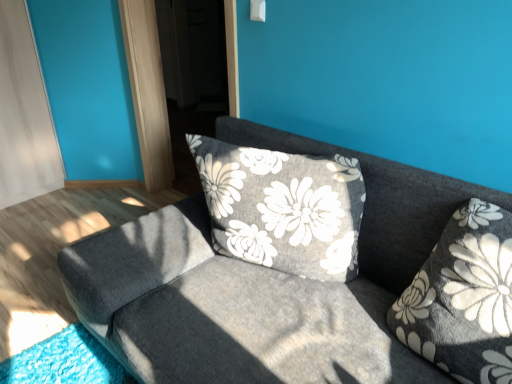
Question: Is transparent glass screen door at upper center bigger or smaller than fluffy gray pillow at right?

Choices:
 (A) big
 (B) small

Answer: (A)

Question: Is transparent glass screen door at upper center in front of or behind fluffy gray pillow at right in the image?

Choices:
 (A) behind
 (B) front

Answer: (A)

Question: Which is farther from the transparent glass screen door at upper center?

Choices:
 (A) textured gray couch at center
 (B) fluffy gray pillow at right

Answer: (B)

Question: Based on their relative distances, which object is nearer to the fluffy gray pillow at right?

Choices:
 (A) transparent glass screen door at upper center
 (B) textured gray couch at center

Answer: (B)